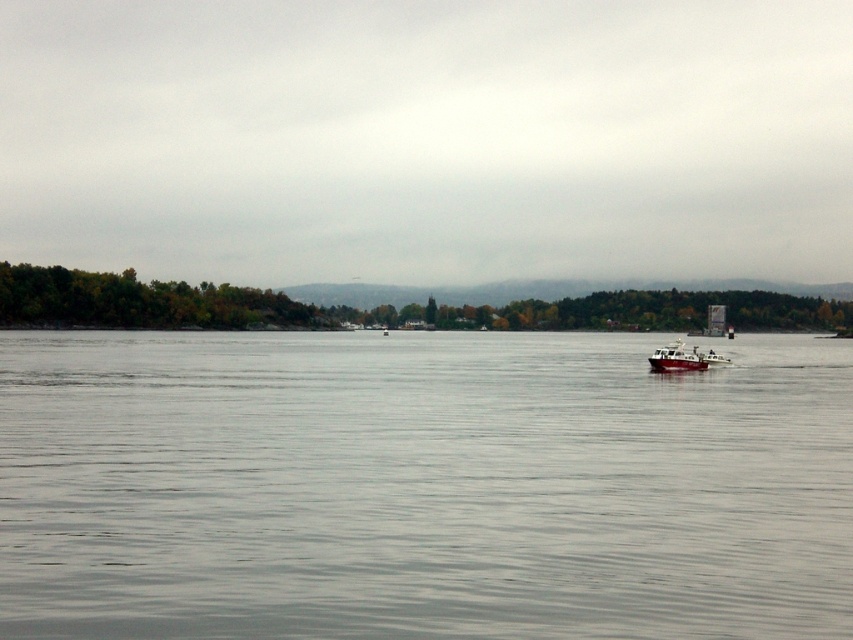
Question: Does red matte boat at center appear on the left side of white plastic boat at right?

Choices:
 (A) yes
 (B) no

Answer: (A)

Question: Does red matte boat at center appear on the right side of white plastic boat at right?

Choices:
 (A) no
 (B) yes

Answer: (A)

Question: Can you confirm if transparent water at center is wider than red matte boat at center?

Choices:
 (A) no
 (B) yes

Answer: (B)

Question: Which of the following is the closest to the observer?

Choices:
 (A) (705, 358)
 (B) (711, 358)
 (C) (830, 548)

Answer: (C)

Question: Which point is closer to the camera?

Choices:
 (A) transparent water at center
 (B) red matte boat at center

Answer: (A)

Question: Estimate the real-world distances between objects in this image. Which object is closer to the white plastic boat at right?

Choices:
 (A) transparent water at center
 (B) red matte boat at center

Answer: (B)